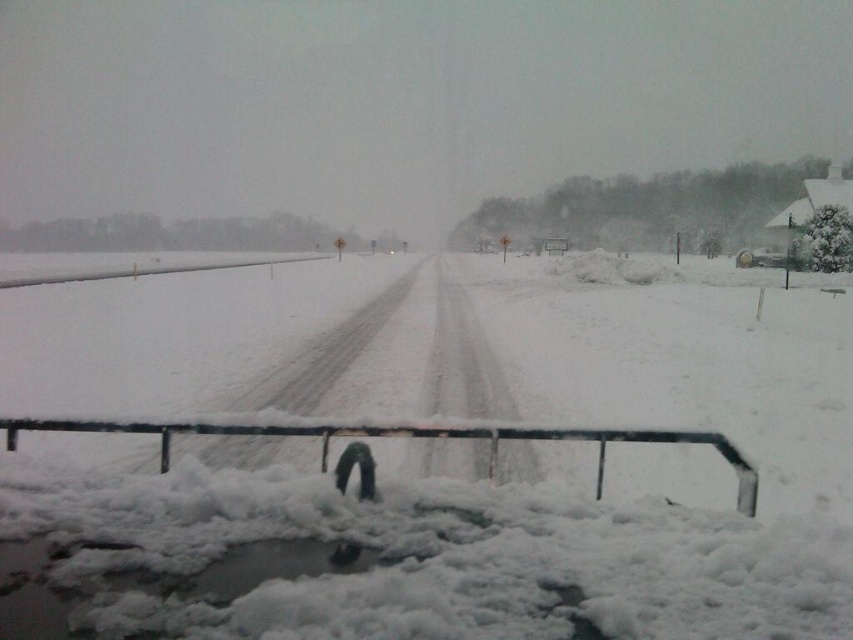
You are a snowplow driver who needs to clear the road. You see the white fluffy snow at center and the black metal rail at center. Which one should you avoid hitting with your plow to prevent damage?

You should avoid hitting the black metal rail at center because it is a solid structure, while the white fluffy snow at center is soft and can be plowed safely.

You are a delivery driver planning to drive along the snowy road. You notice two rails, the black metal rail at center and the white matte rail at left. Which rail is narrower in width?

The black metal rail at center is narrower in width than the white matte rail at left.

You are standing at the bottom left corner of the snowy road and want to walk towards the distant end. There are two points marked on the road. Which point would you reach first as you walk forward? The points are point (74, 486) and point (602, 445).

You would reach point (74, 486) first because it is in front of point (602, 445) along the road.